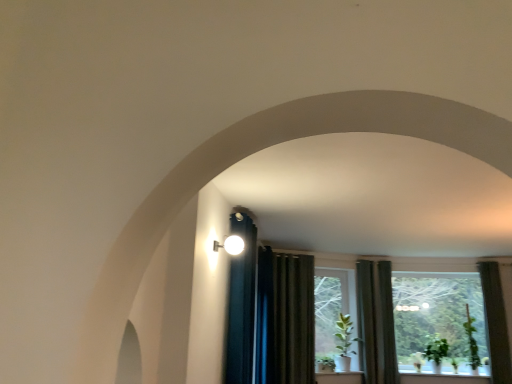
Question: Is matte white sconce at upper center inside the boundaries of green matte plant at lower right, which appears as the 2th plant when viewed from the right, or outside?

Choices:
 (A) outside
 (B) inside

Answer: (A)

Question: Considering the positions of point (230, 240) and point (435, 332), is point (230, 240) closer or farther from the camera than point (435, 332)?

Choices:
 (A) closer
 (B) farther

Answer: (A)

Question: Based on their relative distances, which object is farther from the green fabric curtain at right, the second curtain viewed from the left?

Choices:
 (A) green matte plant at lower right, which is the first plant from left to right
 (B) green matte plant at center
 (C) dark green fabric curtain at right, positioned as the 3th curtain in left-to-right order
 (D) white ceramic window sill at lower center
 (E) matte white sconce at upper center

Answer: (E)

Question: Which object is the closest to the green fabric curtain at right, which is the second curtain in right-to-left order?

Choices:
 (A) white ceramic window sill at lower center
 (B) green leafy plant at right, the second plant in the left-to-right sequence
 (C) transparent glass window at center
 (D) green matte plant at lower right, which appears as the 2th plant when viewed from the right
 (E) green matte plant at center

Answer: (E)